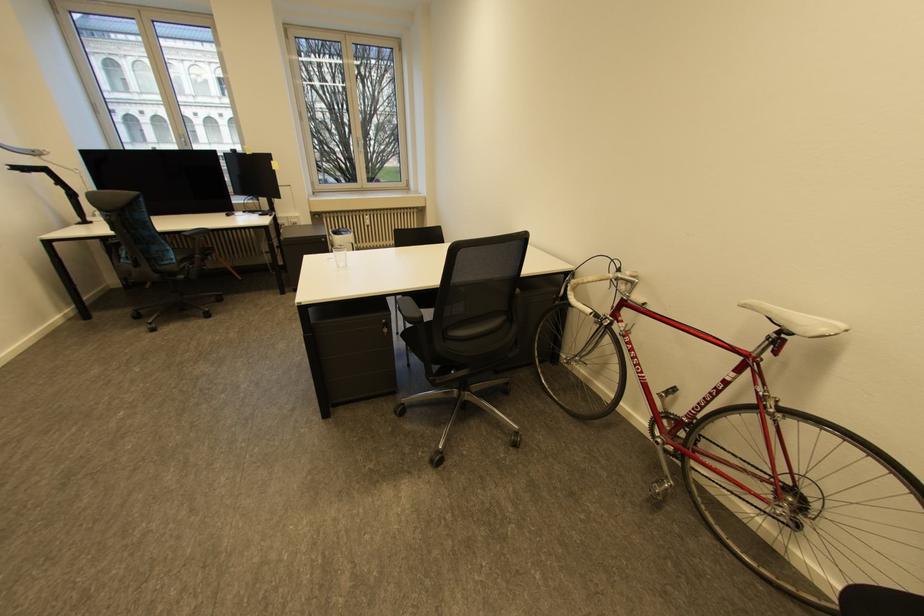
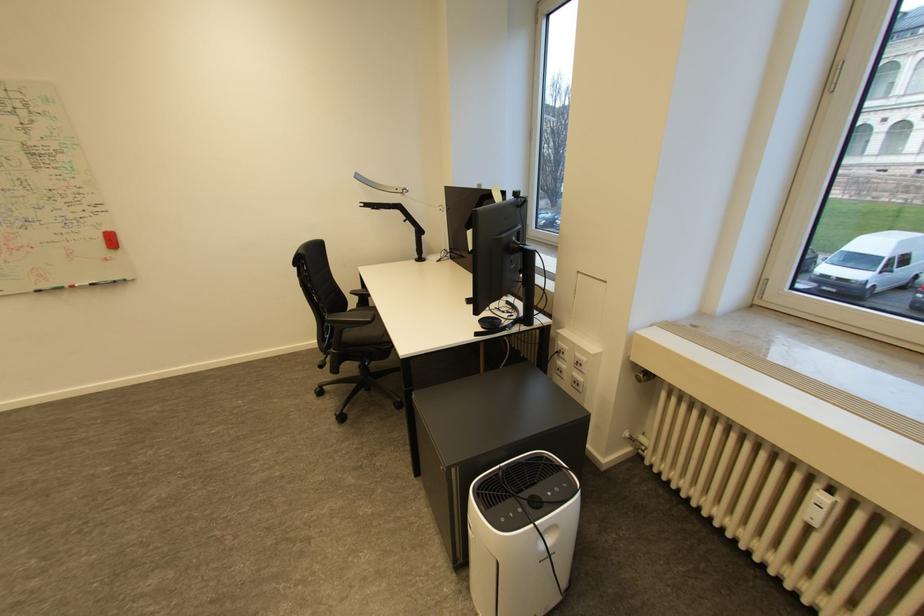
Where in the second image is the point corresponding to point (51, 176) from the first image?

(405, 213)